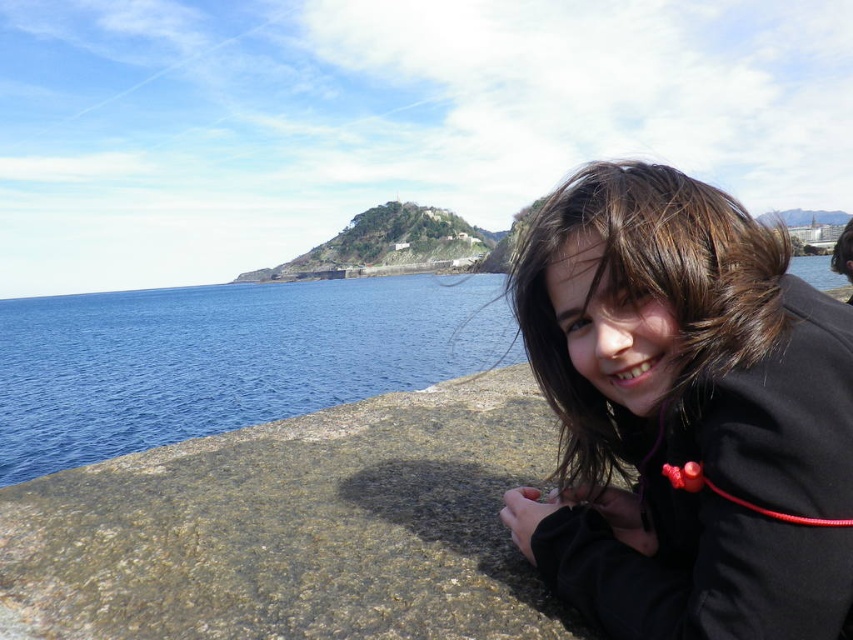
Is the position of black matte jacket at lower right less distant than that of brown hair at lower right?

Yes, it is.

Between black matte jacket at lower right and brown hair at lower right, which one appears on the left side from the viewer's perspective?

black matte jacket at lower right

This screenshot has width=853, height=640. In order to click on black matte jacket at lower right in this screenshot , I will do `click(683, 412)`.

Does blue water at left have a smaller size compared to brown hair at lower right?

No, blue water at left is not smaller than brown hair at lower right.

Between blue water at left and brown hair at lower right, which one is positioned lower?

blue water at left is lower down.

Is point (456, 358) in front of point (850, 221)?

No, it is behind (850, 221).

The width and height of the screenshot is (853, 640). I want to click on blue water at left, so click(x=223, y=358).

Can you confirm if gray rough stone at lower right is positioned to the right of brown hair at lower right?

No, gray rough stone at lower right is not to the right of brown hair at lower right.

Is gray rough stone at lower right bigger than brown hair at lower right?

No.

Who is more distant from viewer, [117,580] or [845,259]?

The point [845,259] is more distant.

In order to click on gray rough stone at lower right in this screenshot , I will do `click(296, 528)`.